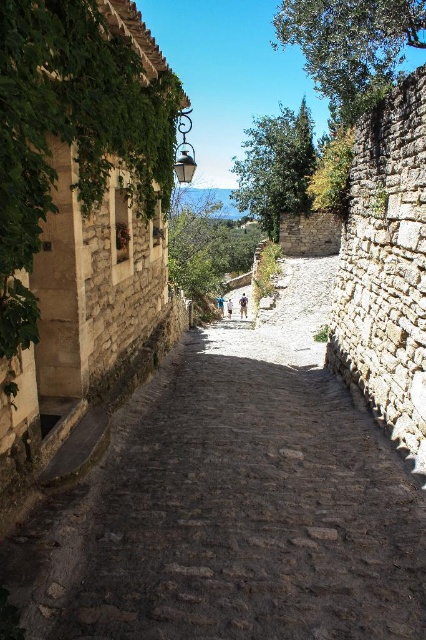
Question: Among these objects, which one is nearest to the camera?

Choices:
 (A) brown cobblestone path at center
 (B) green leafy ivy at upper left

Answer: (A)

Question: Does brown cobblestone path at center come in front of green leafy ivy at upper left?

Choices:
 (A) yes
 (B) no

Answer: (A)

Question: Which object appears farthest from the camera in this image?

Choices:
 (A) brown cobblestone path at center
 (B) green leafy ivy at upper left

Answer: (B)

Question: Can you confirm if brown cobblestone path at center is wider than green leafy ivy at upper left?

Choices:
 (A) no
 (B) yes

Answer: (B)

Question: Can you confirm if brown cobblestone path at center is bigger than green leafy ivy at upper left?

Choices:
 (A) yes
 (B) no

Answer: (A)